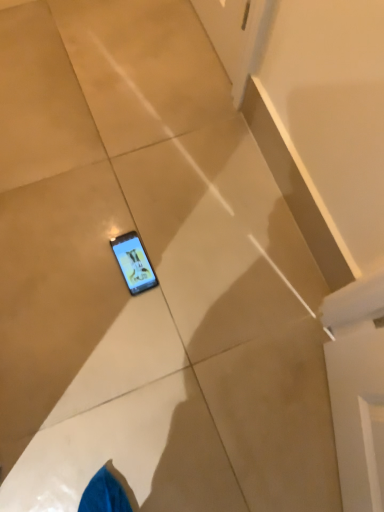
What is the approximate width of shiny black phone at center?

shiny black phone at center is 16.92 centimeters in width.

This screenshot has height=512, width=384. I want to click on shiny black phone at center, so click(134, 263).

This screenshot has height=512, width=384. Describe the element at coordinates (134, 263) in the screenshot. I see `shiny black phone at center` at that location.

What are the coordinates of `shiny black phone at center` in the screenshot? It's located at (134, 263).